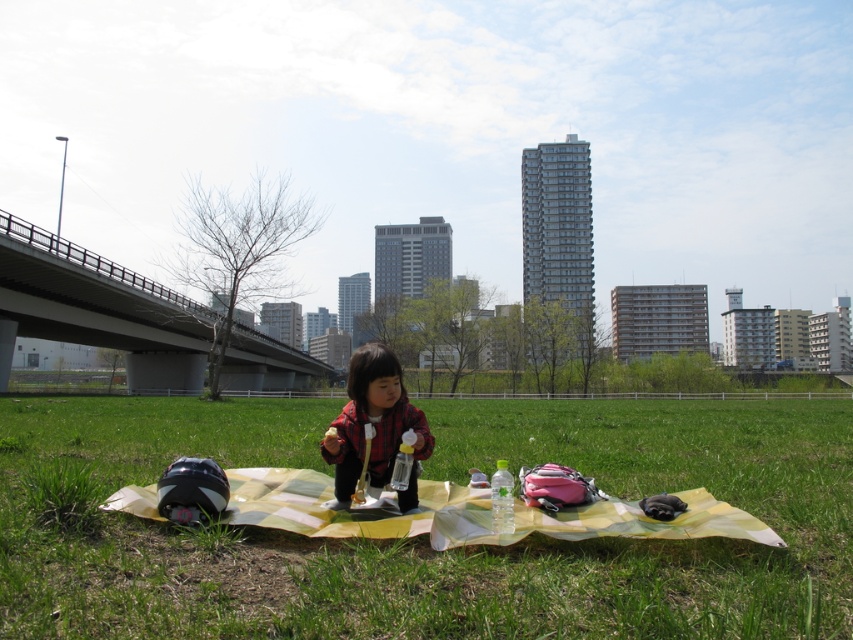
You are a photographer trying to capture the entire scene in one shot. Given that the green grass at center and the matte red shirt at center are both in the frame, which one appears wider in the photo?

The green grass at center appears wider in the photo because its width is larger than that of the matte red shirt at center.

You are a drone operator trying to locate a specific point in the image. According to the coordinates provided, where exactly is the green grass at center located?

The green grass at center is located at the coordinates point (x=427, y=534).